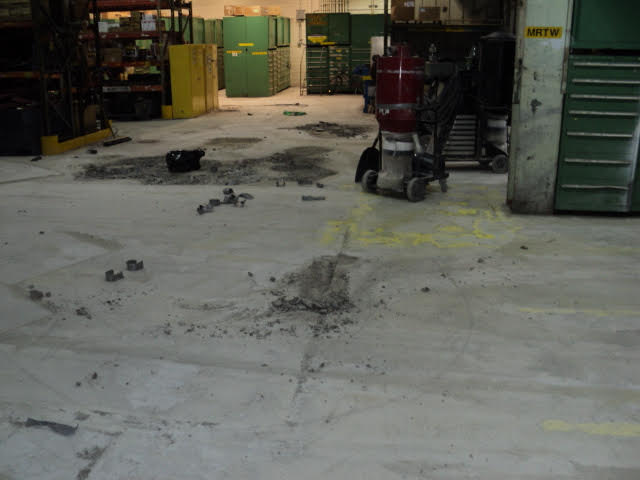
Image resolution: width=640 pixels, height=480 pixels. I want to click on wall, so click(205, 5).